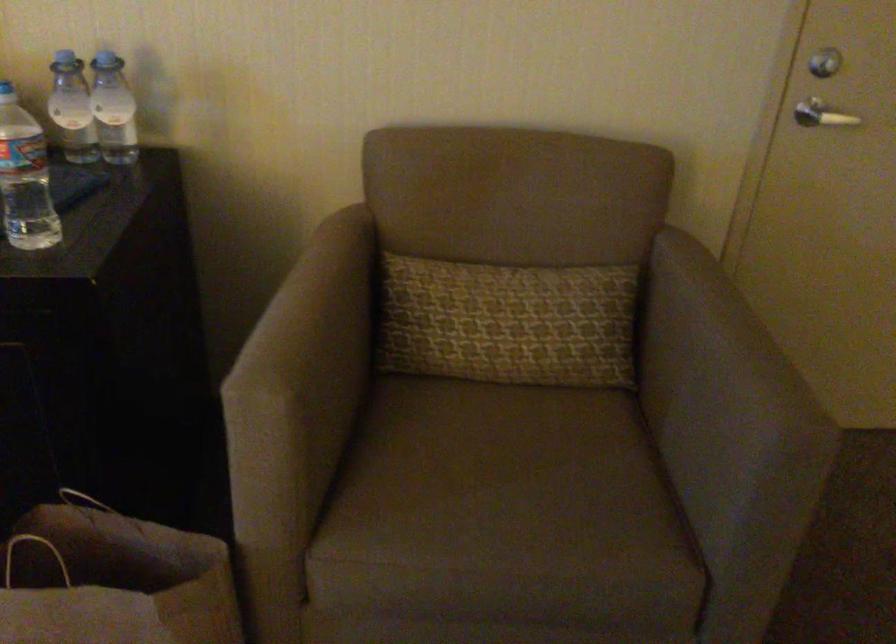
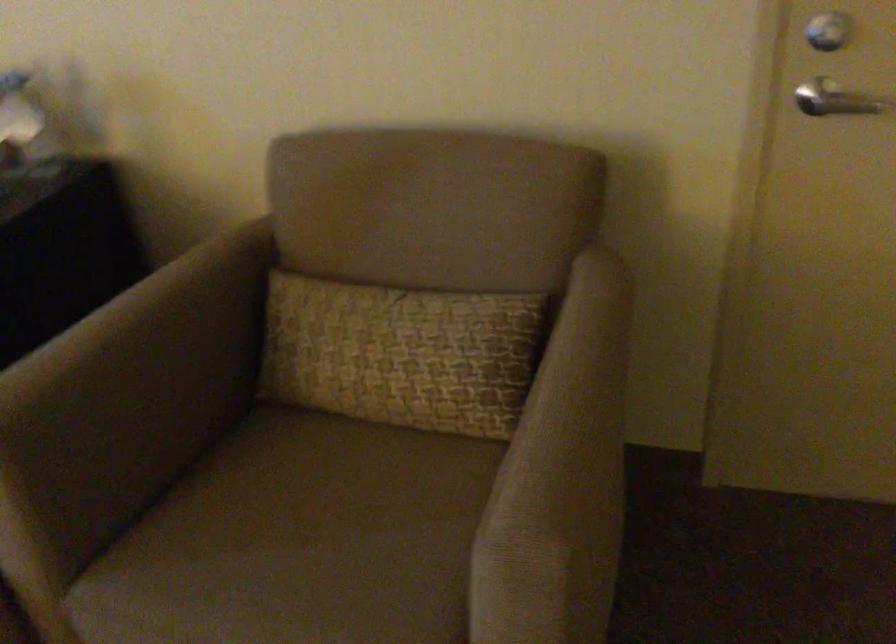
Locate, in the second image, the point that corresponds to [488,448] in the first image.

(314, 500)